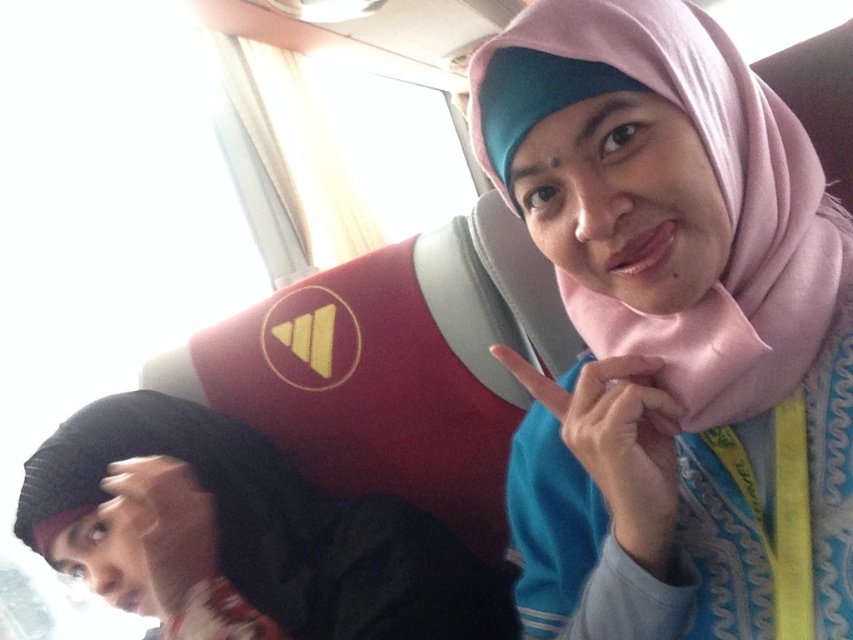
You are a passenger on a bus and want to locate the pink fabric hijab at upper right. According to the coordinates provided, where exactly is it located?

The pink fabric hijab at upper right is located at point (672,332).